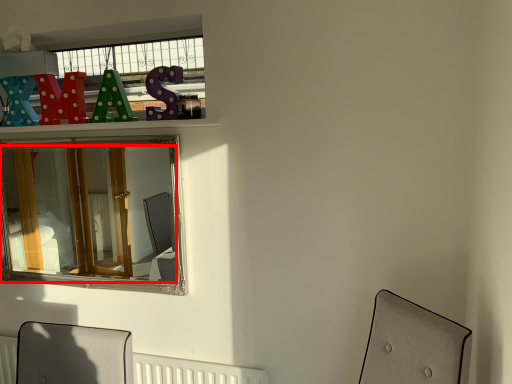
Question: In this image, where is mirror (annotated by the red box) located relative to radiator?

Choices:
 (A) right
 (B) left

Answer: (B)